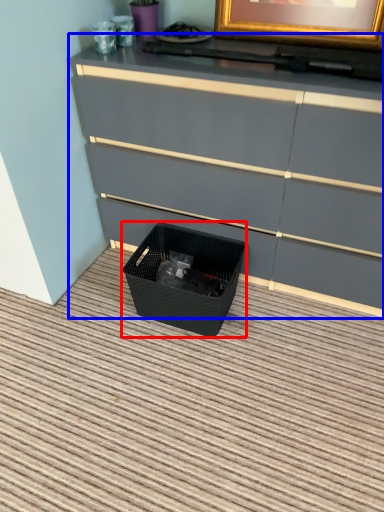
Question: Which point is further to the camera, basket container (highlighted by a red box) or chest of drawers (highlighted by a blue box)?

Choices:
 (A) basket container
 (B) chest of drawers

Answer: (A)